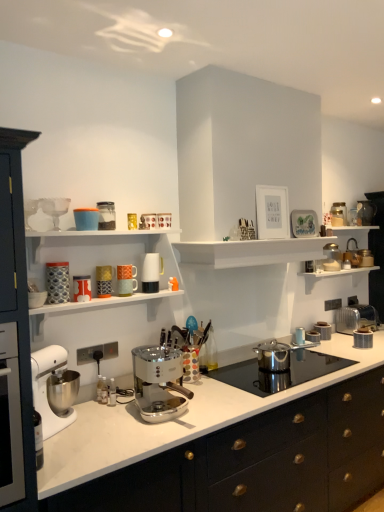
Question: Is metallic silver kettle at upper right, the fourth appliance in the top-to-bottom sequence, looking in the opposite direction of metallic silver toaster at upper right, the fourth appliance from the bottom?

Choices:
 (A) no
 (B) yes

Answer: (A)

Question: Would you say metallic silver toaster at upper right, the fifth appliance viewed from the top, is part of metallic silver kettle at upper right, the fourth appliance in the top-to-bottom sequence,'s contents?

Choices:
 (A) no
 (B) yes

Answer: (A)

Question: From the image's perspective, is metallic silver kettle at upper right, arranged as the 3th appliance when viewed from the right, beneath metallic silver toaster at upper right, the fifth appliance viewed from the top?

Choices:
 (A) no
 (B) yes

Answer: (A)

Question: Considering the relative positions of metallic silver kettle at upper right, arranged as the 3th appliance when viewed from the right, and metallic silver toaster at upper right, which is the 4th appliance in back-to-front order, in the image provided, is metallic silver kettle at upper right, arranged as the 3th appliance when viewed from the right, behind metallic silver toaster at upper right, which is the 4th appliance in back-to-front order,?

Choices:
 (A) yes
 (B) no

Answer: (A)

Question: Is metallic silver kettle at upper right, which appears as the sixth appliance when viewed from the front, taller than metallic silver toaster at upper right, which is the 4th appliance in back-to-front order?

Choices:
 (A) yes
 (B) no

Answer: (A)

Question: Considering the positions of patterned ceramic mug at left, which appears as the first kitchen appliance when viewed from the left, and metallic silver toaster at upper right, which is the 4th appliance in back-to-front order, in the image, is patterned ceramic mug at left, which appears as the first kitchen appliance when viewed from the left, bigger or smaller than metallic silver toaster at upper right, which is the 4th appliance in back-to-front order,?

Choices:
 (A) big
 (B) small

Answer: (B)

Question: From the image's perspective, is patterned ceramic mug at left, which appears as the first kitchen appliance when viewed from the left, located above or below metallic silver toaster at upper right, the fourth appliance from the bottom?

Choices:
 (A) below
 (B) above

Answer: (A)

Question: Relative to metallic silver toaster at upper right, which is the 4th appliance in back-to-front order, is patterned ceramic mug at left, marked as the twelfth kitchen appliance in a back-to-front arrangement, in front or behind?

Choices:
 (A) front
 (B) behind

Answer: (A)

Question: Would you say patterned ceramic mug at left, arranged as the 12th kitchen appliance when viewed from the right, is inside or outside metallic silver toaster at upper right, the fifth appliance viewed from the top?

Choices:
 (A) inside
 (B) outside

Answer: (B)

Question: In the image, is matte ceramic mug at upper center, which ranks as the sixth kitchen appliance in back-to-front order, positioned in front of or behind patterned ceramic mug at left, the first kitchen appliance positioned from the front?

Choices:
 (A) behind
 (B) front

Answer: (A)

Question: Considering the positions of matte ceramic mug at upper center, which ranks as the sixth kitchen appliance in back-to-front order, and patterned ceramic mug at left, marked as the twelfth kitchen appliance in a back-to-front arrangement, in the image, is matte ceramic mug at upper center, which ranks as the sixth kitchen appliance in back-to-front order, wider or thinner than patterned ceramic mug at left, marked as the twelfth kitchen appliance in a back-to-front arrangement,?

Choices:
 (A) wide
 (B) thin

Answer: (B)

Question: In terms of height, does matte ceramic mug at upper center, the 7th kitchen appliance positioned from the front, look taller or shorter compared to patterned ceramic mug at left, which appears as the first kitchen appliance when viewed from the left?

Choices:
 (A) short
 (B) tall

Answer: (A)

Question: Based on their sizes in the image, would you say matte ceramic mug at upper center, which ranks as the sixth kitchen appliance in back-to-front order, is bigger or smaller than patterned ceramic mug at left, arranged as the 12th kitchen appliance when viewed from the right?

Choices:
 (A) big
 (B) small

Answer: (B)

Question: Is metallic gold coffee maker at upper center, which ranks as the 9th kitchen appliance in back-to-front order, taller or shorter than white matte shelf at upper center?

Choices:
 (A) short
 (B) tall

Answer: (A)

Question: Do you think metallic gold coffee maker at upper center, which ranks as the 9th kitchen appliance in back-to-front order, is within white matte shelf at upper center, or outside of it?

Choices:
 (A) outside
 (B) inside

Answer: (A)